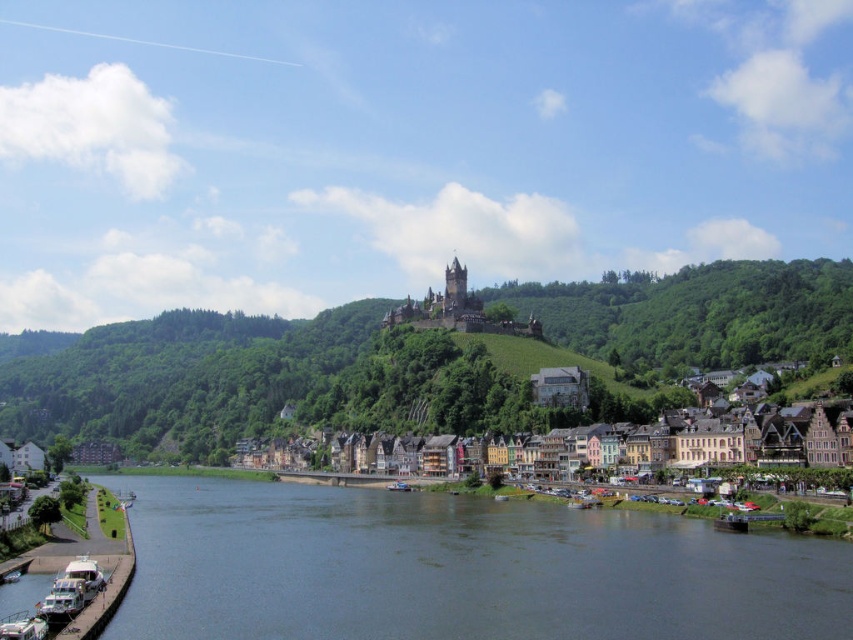
Question: Which object is positioned farthest from the white plastic boat at lower left?

Choices:
 (A) multicolored stone buildings at center
 (B) dark blue water at lower center
 (C) white glossy boat at lower left

Answer: (A)

Question: Can you confirm if dark blue water at lower center is bigger than green leafy hillside at center?

Choices:
 (A) yes
 (B) no

Answer: (B)

Question: Is green leafy hillside at center smaller than white plastic boat at lower left?

Choices:
 (A) yes
 (B) no

Answer: (B)

Question: Which of the following is the farthest from the observer?

Choices:
 (A) white plastic boat at lower left
 (B) dark blue water at lower center

Answer: (B)

Question: Which object appears closest to the camera in this image?

Choices:
 (A) white glossy boat at lower left
 (B) multicolored stone buildings at center
 (C) dark blue water at lower center
 (D) green leafy hillside at center

Answer: (C)

Question: Does dark blue water at lower center come in front of white plastic boat at lower left?

Choices:
 (A) yes
 (B) no

Answer: (B)